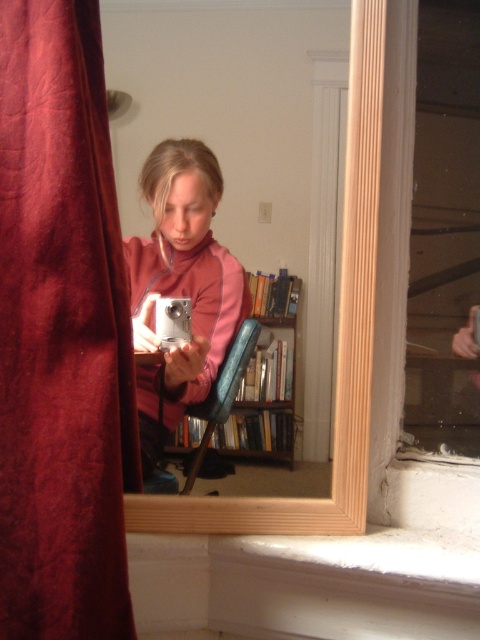
Consider the image. How much distance is there between velvet red curtain at left and woodenmaterial/texturebookshelf at center?

The distance of velvet red curtain at left from woodenmaterial/texturebookshelf at center is 11.49 inches.

Does point (1, 547) come closer to viewer compared to point (267, 298)?

Yes, point (1, 547) is in front of point (267, 298).

Find the location of a particular element. velvet red curtain at left is located at coordinates (61, 333).

Can you confirm if wooden mirror at center is positioned below woodenmaterial/texturebookshelf at center?

No.

Is point (345, 259) positioned after point (267, 420)?

No, (345, 259) is in front of (267, 420).

Who is more forward, (x=349, y=240) or (x=284, y=349)?

Point (x=349, y=240)

Locate an element on the screen. The image size is (480, 640). wooden mirror at center is located at coordinates (337, 346).

Can you confirm if matte pink sweater at center is wider than woodenmaterial/texturebookshelf at center?

Incorrect, matte pink sweater at center's width does not surpass woodenmaterial/texturebookshelf at center's.

Can you confirm if matte pink sweater at center is shorter than woodenmaterial/texturebookshelf at center?

Incorrect, matte pink sweater at center's height does not fall short of woodenmaterial/texturebookshelf at center's.

You are a GUI agent. You are given a task and a screenshot of the screen. Output one action in this format:
    pyautogui.click(x=<x>, y=<y>)
    Task: Click on the matte pink sweater at center
    The image size is (480, 640).
    Given the screenshot: What is the action you would take?
    pyautogui.click(x=180, y=292)